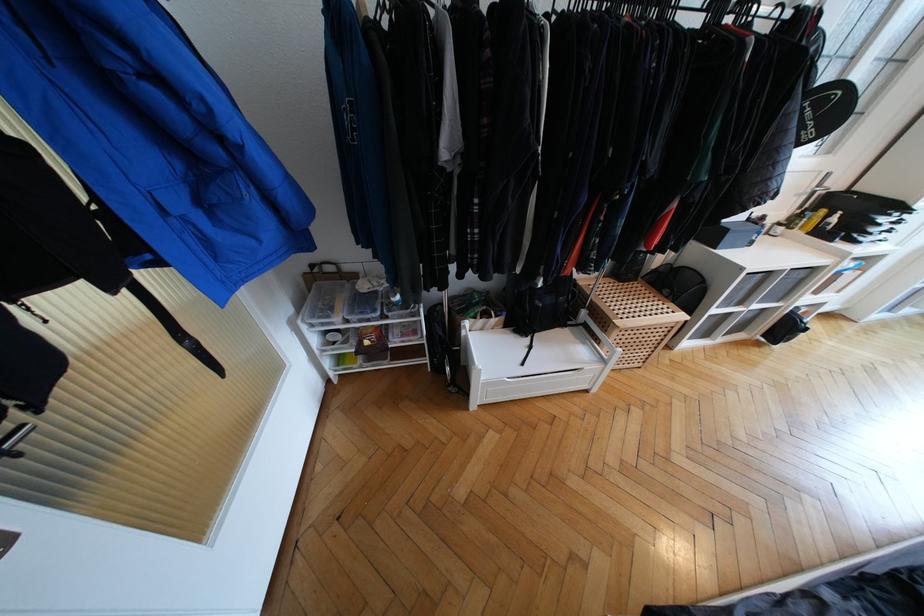
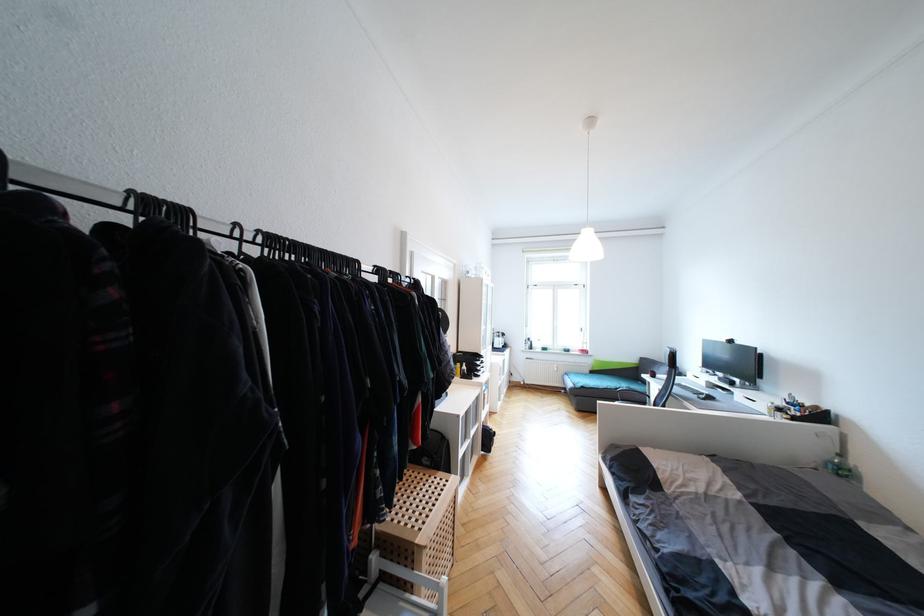
Based on the continuous images, in which direction is the camera rotating?

The rotation direction of the camera is right-up.